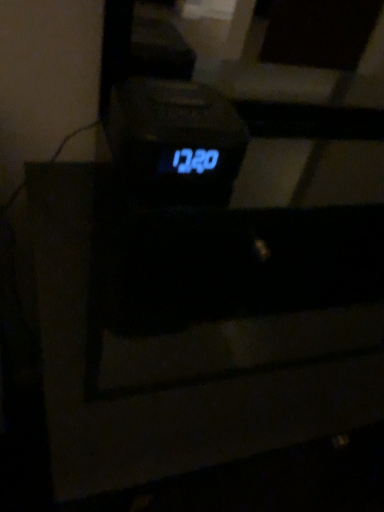
The height and width of the screenshot is (512, 384). In order to click on black plastic drawer at center in this screenshot , I will do tap(198, 329).

The image size is (384, 512). Describe the element at coordinates (198, 329) in the screenshot. I see `black plastic drawer at center` at that location.

The height and width of the screenshot is (512, 384). What do you see at coordinates (176, 140) in the screenshot?
I see `blue led display at center` at bounding box center [176, 140].

Image resolution: width=384 pixels, height=512 pixels. Find the location of `blue led display at center`. blue led display at center is located at coordinates (176, 140).

Measure the distance between point (x=123, y=133) and camera.

The distance of point (x=123, y=133) from camera is 20.12 inches.

Locate an element on the screen. This screenshot has width=384, height=512. black plastic drawer at center is located at coordinates (198, 329).

Which is more to the right, blue led display at center or black plastic drawer at center?

From the viewer's perspective, black plastic drawer at center appears more on the right side.

Who is more distant, blue led display at center or black plastic drawer at center?

Positioned behind is blue led display at center.

Does point (154, 166) lie behind point (304, 385)?

No, it is not.

From the image's perspective, is blue led display at center on top of black plastic drawer at center?

Result: Yes.

From a real-world perspective, is blue led display at center above or below black plastic drawer at center?

blue led display at center is situated higher than black plastic drawer at center in the real world.

Can you confirm if blue led display at center is wider than black plastic drawer at center?

No, blue led display at center is not wider than black plastic drawer at center.

Is blue led display at center shorter than black plastic drawer at center?

Correct, blue led display at center is not as tall as black plastic drawer at center.

Consider the image. Who is bigger, blue led display at center or black plastic drawer at center?

With larger size is black plastic drawer at center.

In the scene shown: Which is correct: blue led display at center is inside black plastic drawer at center, or outside of it?

blue led display at center lies outside black plastic drawer at center.

Are blue led display at center and black plastic drawer at center located far from each other?

blue led display at center is near black plastic drawer at center, not far away.

Could you tell me if blue led display at center is turned towards black plastic drawer at center?

No.

Locate an element on the screen. The width and height of the screenshot is (384, 512). furniture in front of the blue led display at center is located at coordinates (198, 329).

Between black plastic drawer at center and blue led display at center, which one appears on the left side from the viewer's perspective?

blue led display at center is more to the left.

Relative to blue led display at center, is black plastic drawer at center in front or behind?

black plastic drawer at center is positioned closer to the viewer than blue led display at center.

Which is in front, point (109, 287) or point (222, 140)?

The point (222, 140) is closer.

From the image's perspective, which object appears higher, black plastic drawer at center or blue led display at center?

blue led display at center is shown above in the image.

From a real-world perspective, which object rests below the other?

black plastic drawer at center.

Can you confirm if black plastic drawer at center is wider than blue led display at center?

Indeed, black plastic drawer at center has a greater width compared to blue led display at center.

Consider the image. Who is shorter, black plastic drawer at center or blue led display at center?

With less height is blue led display at center.

Looking at this image, can you confirm if black plastic drawer at center is smaller than blue led display at center?

No.

Is black plastic drawer at center located outside blue led display at center?

Indeed, black plastic drawer at center is completely outside blue led display at center.

From the picture: Is black plastic drawer at center with blue led display at center?

black plastic drawer at center is not next to blue led display at center, and they're not touching.

Could you tell me if black plastic drawer at center is facing blue led display at center?

No, black plastic drawer at center does not turn towards blue led display at center.

How much distance is there between black plastic drawer at center and blue led display at center?

They are 26.39 inches apart.

Find the location of a particular element. This screenshot has width=384, height=512. furniture below the blue led display at center (from a real-world perspective) is located at coordinates (198, 329).

At what (x,y) coordinates should I click in order to perform the action: click on digital clock that appears above the black plastic drawer at center (from the image's perspective). Please return your answer as a coordinate pair (x, y). This screenshot has width=384, height=512. Looking at the image, I should click on (176, 140).

Find the location of a particular element. The height and width of the screenshot is (512, 384). furniture below the blue led display at center (from the image's perspective) is located at coordinates (198, 329).